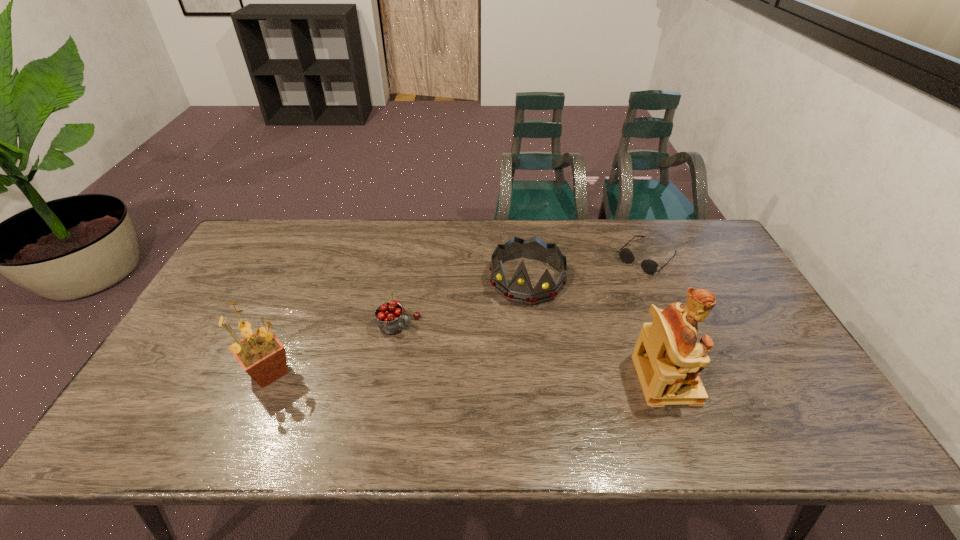
You are a GUI agent. You are given a task and a screenshot of the screen. Output one action in this format:
    pyautogui.click(x=<x>, y=<y>)
    Task: Click on the vacant space on the desktop that is between the fourth shortest object and the tallest object and is positioned on the front-facing side of the sunglasses
    
    Given the screenshot: What is the action you would take?
    pyautogui.click(x=522, y=376)

In order to click on vacant spot on the desktop that is between the sunflower and the figurine and is positioned at the front of the third object from left to right with jewels in this screenshot , I will do `click(496, 376)`.

The width and height of the screenshot is (960, 540). In order to click on vacant space on the desktop that is between the sunflower and the tallest object and is positioned on the handle side of the fourth object from right to left in this screenshot , I will do `click(500, 376)`.